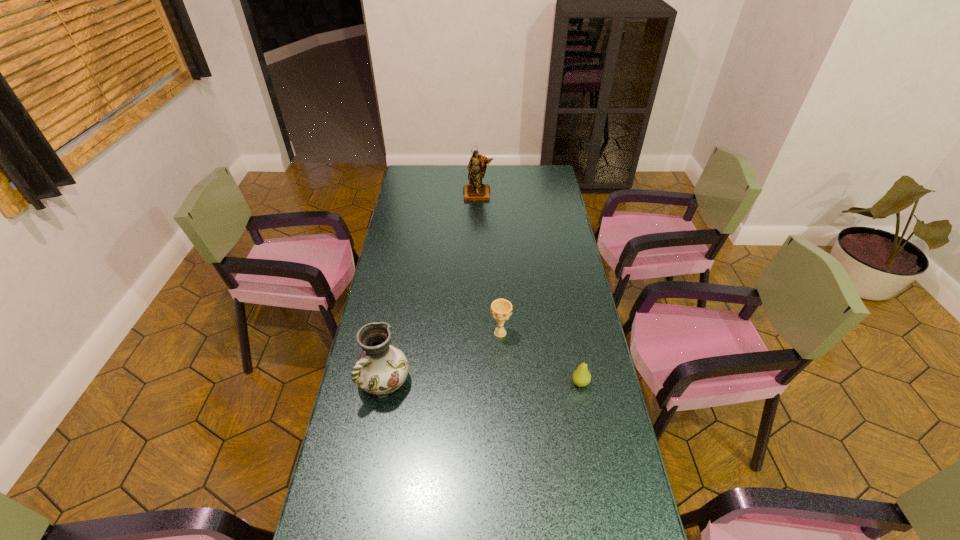
The image size is (960, 540). Identify the location of free area in between the figurine and the third nearest object. (490, 264).

Locate an element on the screen. The height and width of the screenshot is (540, 960). free space between the shortest object and the leftmost object is located at coordinates (483, 382).

This screenshot has height=540, width=960. Find the location of `blank region between the shortest object and the figurine`. blank region between the shortest object and the figurine is located at coordinates (529, 288).

The image size is (960, 540). I want to click on free space between the farthest object and the pear, so click(529, 288).

Where is `unoccupied area between the pear and the figurine`? unoccupied area between the pear and the figurine is located at coordinates (529, 288).

At what (x,y) coordinates should I click in order to perform the action: click on unoccupied area between the figurine and the second farthest object. Please return your answer as a coordinate pair (x, y). Image resolution: width=960 pixels, height=540 pixels. Looking at the image, I should click on (490, 264).

You are a GUI agent. You are given a task and a screenshot of the screen. Output one action in this format:
    pyautogui.click(x=<x>, y=<y>)
    Task: Click on the object that is the closest one to the second farthest object
    This screenshot has width=960, height=540.
    Given the screenshot: What is the action you would take?
    pyautogui.click(x=581, y=377)

This screenshot has height=540, width=960. Find the location of `object that is the third closest to the leftmost object`. object that is the third closest to the leftmost object is located at coordinates (475, 190).

The image size is (960, 540). Identify the location of vacant region that satisfies the following two spatial constraints: 1. on the front-facing side of the third nearest object; 2. on the left side of the farthest object. (477, 333).

Locate an element on the screen. This screenshot has width=960, height=540. free spot that satisfies the following two spatial constraints: 1. on the front-facing side of the pear; 2. on the left side of the farthest object is located at coordinates (477, 382).